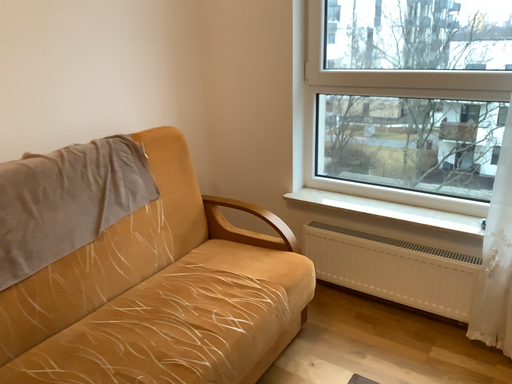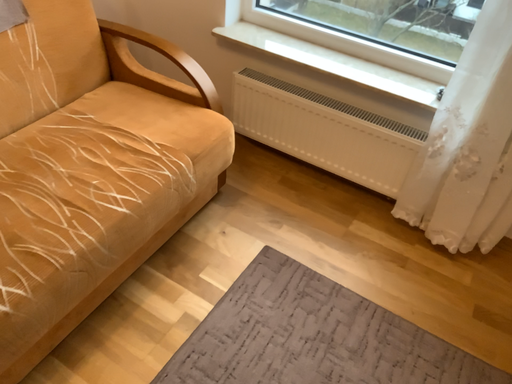
Question: Which way did the camera rotate in the video?

Choices:
 (A) rotated downward
 (B) rotated upward

Answer: (A)